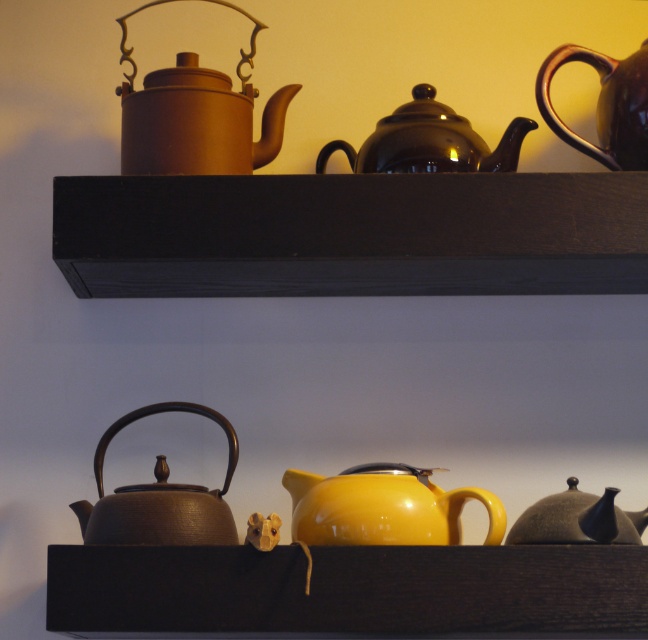
You are standing in front of the shelves and want to reach two points on the shelves. One is at point (305, 182) and the other is at point (627, 113). Which point will be easier to reach?

Point (305, 182) is closer to the camera than point (627, 113), so it will be easier to reach.